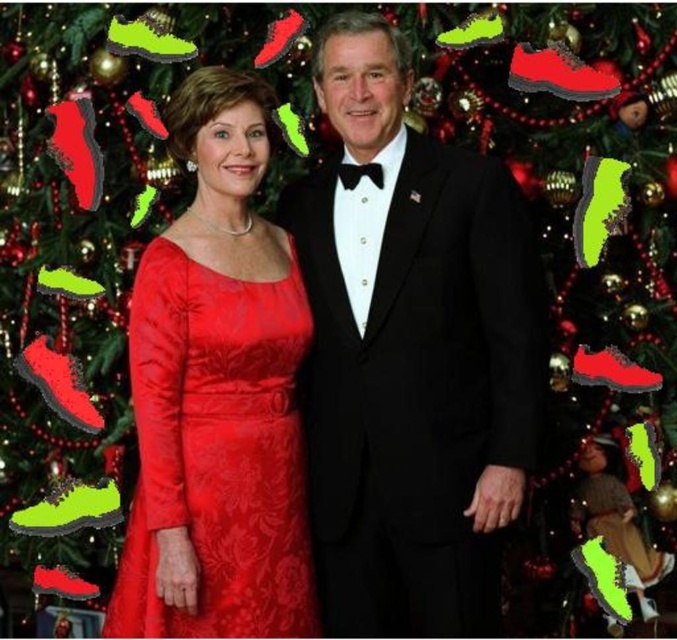
Question: Which object appears farthest from the camera in this image?

Choices:
 (A) black satin suit at center
 (B) matte velvet dress at center

Answer: (A)

Question: Which point is closer to the camera?

Choices:
 (A) (473, 618)
 (B) (244, 547)

Answer: (B)

Question: Does black satin suit at center come behind matte velvet dress at center?

Choices:
 (A) no
 (B) yes

Answer: (B)

Question: Is black satin suit at center wider than matte velvet dress at center?

Choices:
 (A) no
 (B) yes

Answer: (B)

Question: Among these objects, which one is farthest from the camera?

Choices:
 (A) black satin suit at center
 (B) matte velvet dress at center

Answer: (A)

Question: Can you confirm if black satin suit at center is wider than matte velvet dress at center?

Choices:
 (A) no
 (B) yes

Answer: (B)